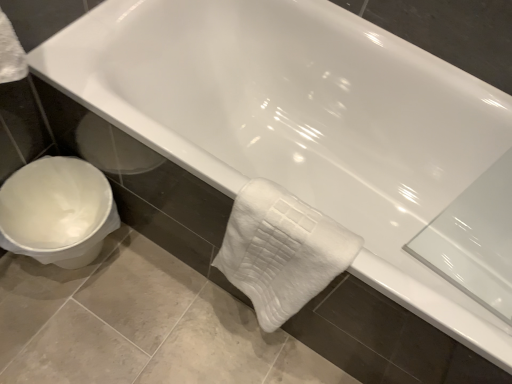
This screenshot has width=512, height=384. What are the coordinates of `free point above white fluffy bath towel at lower center (from a real-world perspective)` in the screenshot? It's located at (286, 216).